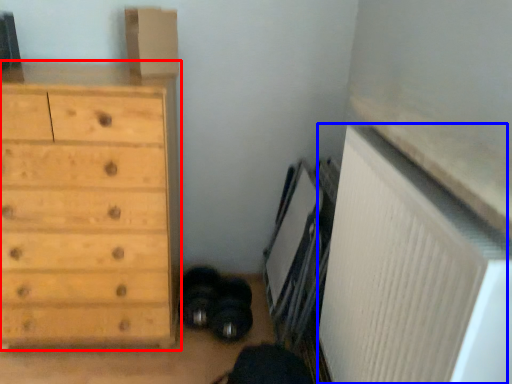
Question: Among these objects, which one is nearest to the camera, chest of drawers (highlighted by a red box) or radiator (highlighted by a blue box)?

Choices:
 (A) chest of drawers
 (B) radiator

Answer: (B)